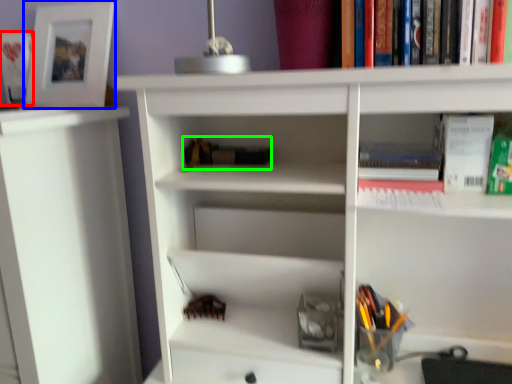
Question: Estimate the real-world distances between objects in this image. Which object is closer to book (highlighted by a red box), picture frame (highlighted by a blue box) or book (highlighted by a green box)?

Choices:
 (A) picture frame
 (B) book

Answer: (A)